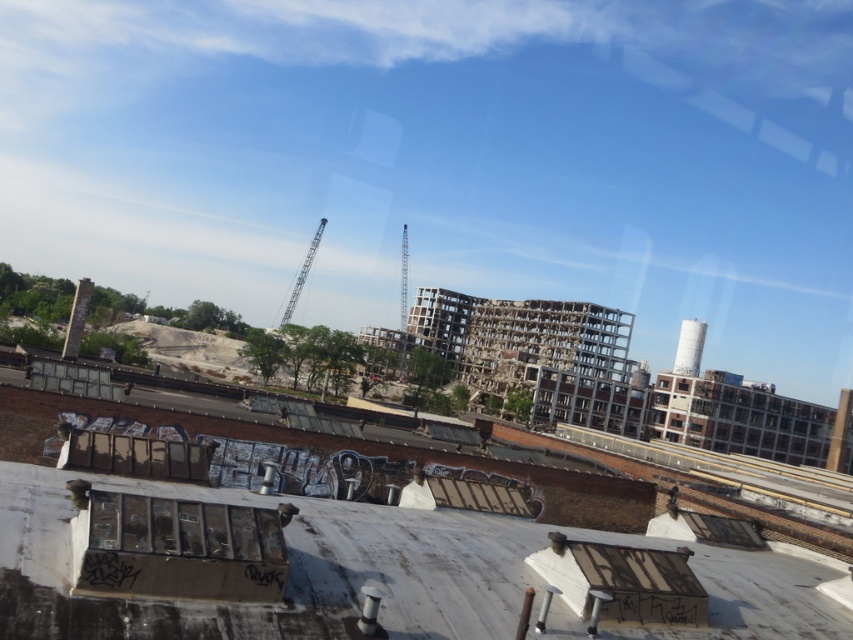
Is metallic glass train window at lower left above metallic gray crane at center?

No, metallic glass train window at lower left is not above metallic gray crane at center.

Between metallic glass train window at lower left and metallic gray crane at center, which one is positioned lower?

metallic glass train window at lower left

Is point (277, 509) farther from camera compared to point (302, 273)?

No, it is not.

The image size is (853, 640). Identify the location of metallic glass train window at lower left. (184, 528).

This screenshot has width=853, height=640. I want to click on exposed concrete rubble at center, so click(202, 500).

Can you confirm if exposed concrete rubble at center is taller than metallic gray crane at center?

In fact, exposed concrete rubble at center may be shorter than metallic gray crane at center.

You are a GUI agent. You are given a task and a screenshot of the screen. Output one action in this format:
    pyautogui.click(x=<x>, y=<y>)
    Task: Click on the exposed concrete rubble at center
    The image size is (853, 640).
    Given the screenshot: What is the action you would take?
    pyautogui.click(x=202, y=500)

Between exposed concrete rubble at center and metallic glass train window at lower left, which one appears on the left side from the viewer's perspective?

Positioned to the left is exposed concrete rubble at center.

Is exposed concrete rubble at center smaller than metallic glass train window at lower left?

Incorrect, exposed concrete rubble at center is not smaller in size than metallic glass train window at lower left.

Is point (469, 554) positioned in front of point (126, 536)?

No, (469, 554) is behind (126, 536).

In order to click on exposed concrete rubble at center in this screenshot , I will do `click(202, 500)`.